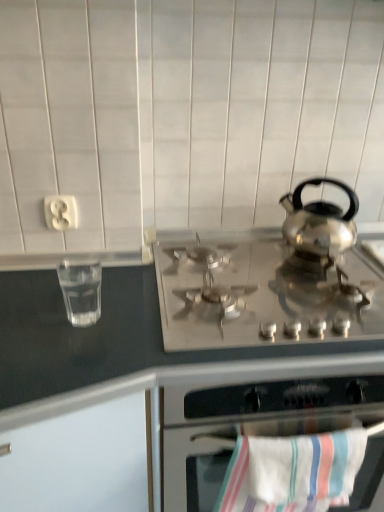
Question: Considering their positions, is white plastic outlet at upper left located in front of or behind striped cotton beach towel at lower center?

Choices:
 (A) behind
 (B) front

Answer: (A)

Question: From their relative heights in the image, would you say white plastic outlet at upper left is taller or shorter than striped cotton beach towel at lower center?

Choices:
 (A) short
 (B) tall

Answer: (A)

Question: Which is nearer to the clear glass water at left?

Choices:
 (A) satin silver gas stove at center
 (B) white plastic outlet at upper left
 (C) stainless steel gas stove at center
 (D) striped cotton beach towel at lower center

Answer: (B)

Question: Considering the real-world distances, which object is farthest from the white plastic outlet at upper left?

Choices:
 (A) clear glass water at left
 (B) satin silver gas stove at center
 (C) stainless steel gas stove at center
 (D) striped cotton beach towel at lower center

Answer: (D)